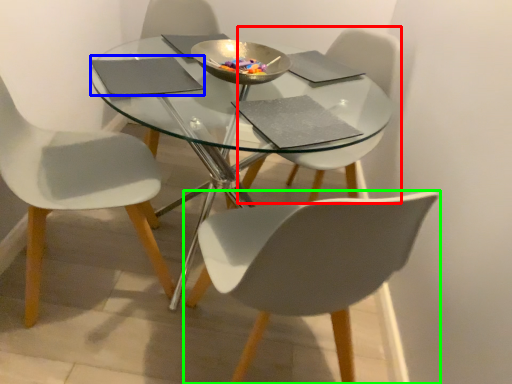
Question: Estimate the real-world distances between objects in this image. Which object is farther from chair (highlighted by a red box), pad (highlighted by a blue box) or chair (highlighted by a green box)?

Choices:
 (A) pad
 (B) chair

Answer: (A)